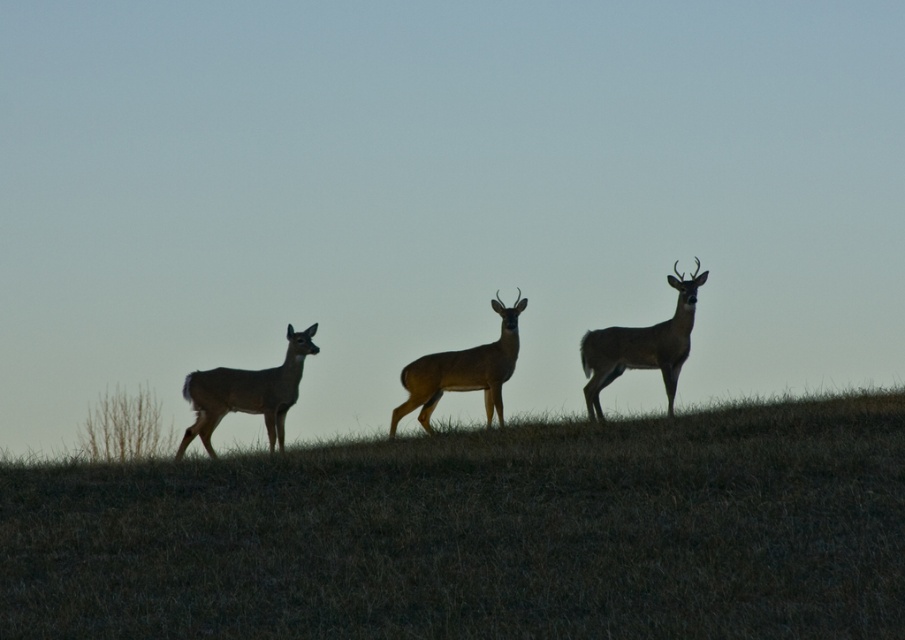
Question: Which point is closer to the camera taking this photo?

Choices:
 (A) (434, 368)
 (B) (491, 625)

Answer: (B)

Question: Is brown grassy at center positioned before brown matte deer at center?

Choices:
 (A) yes
 (B) no

Answer: (A)

Question: Which object appears farthest from the camera in this image?

Choices:
 (A) brown matte deer at center
 (B) brown grassy at center

Answer: (A)

Question: Can you confirm if brown grassy at center is positioned to the left of silhouette velvet deer at left?

Choices:
 (A) no
 (B) yes

Answer: (B)

Question: Estimate the real-world distances between objects in this image. Which object is closer to the brown fur deer at center?

Choices:
 (A) brown matte deer at center
 (B) brown grassy at center
 (C) silhouette velvet deer at left

Answer: (A)

Question: Does brown fur deer at center appear on the right side of brown matte deer at center?

Choices:
 (A) yes
 (B) no

Answer: (A)